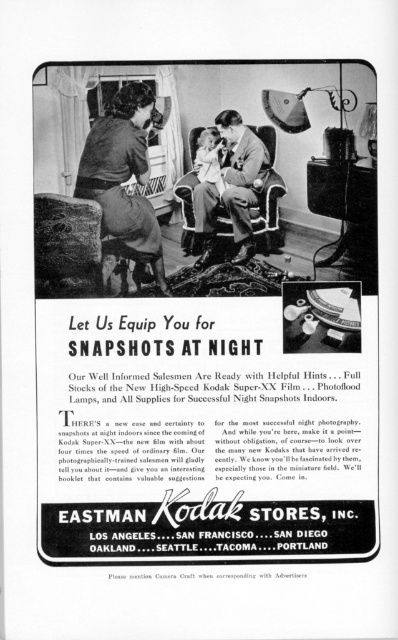
What is the location of the point with coordinates (124, 173) in the vintage Kodak ad?

The point with coordinates (124, 173) is located on the matte black dress at upper left in the vintage Kodak ad.

Based on the scene described in the vintage Kodak advertisement, where is the matte black dress at upper left positioned in relation to the matte black suit at center?

The matte black dress at upper left is located below the matte black suit at center.